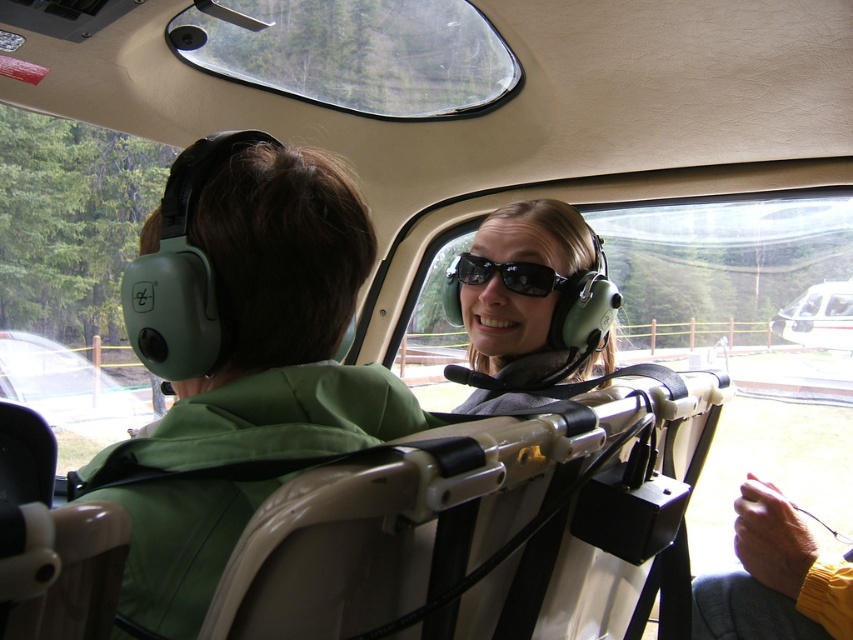
Question: Which of the following is the closest to the observer?

Choices:
 (A) white glossy helicopter at center
 (B) yellow sweater at lower right

Answer: (B)

Question: Which point appears closest to the camera in this image?

Choices:
 (A) (529, 268)
 (B) (181, 561)

Answer: (B)

Question: Is yellow sweater at lower right to the right of white glossy helicopter at center from the viewer's perspective?

Choices:
 (A) no
 (B) yes

Answer: (A)

Question: Among these objects, which one is nearest to the camera?

Choices:
 (A) white glossy helicopter at center
 (B) yellow sweater at lower right
 (C) matte green headphones at center
 (D) black reflective sunglasses at center

Answer: (B)

Question: Can you confirm if green matte jacket at center is smaller than yellow sweater at lower right?

Choices:
 (A) yes
 (B) no

Answer: (B)

Question: Can you confirm if green matte jacket at center is positioned below yellow sweater at lower right?

Choices:
 (A) yes
 (B) no

Answer: (B)